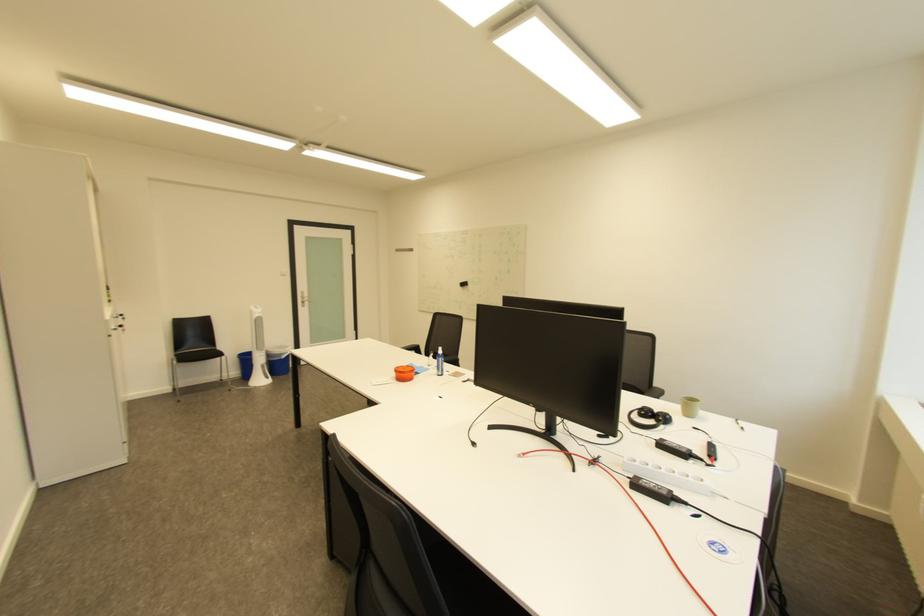
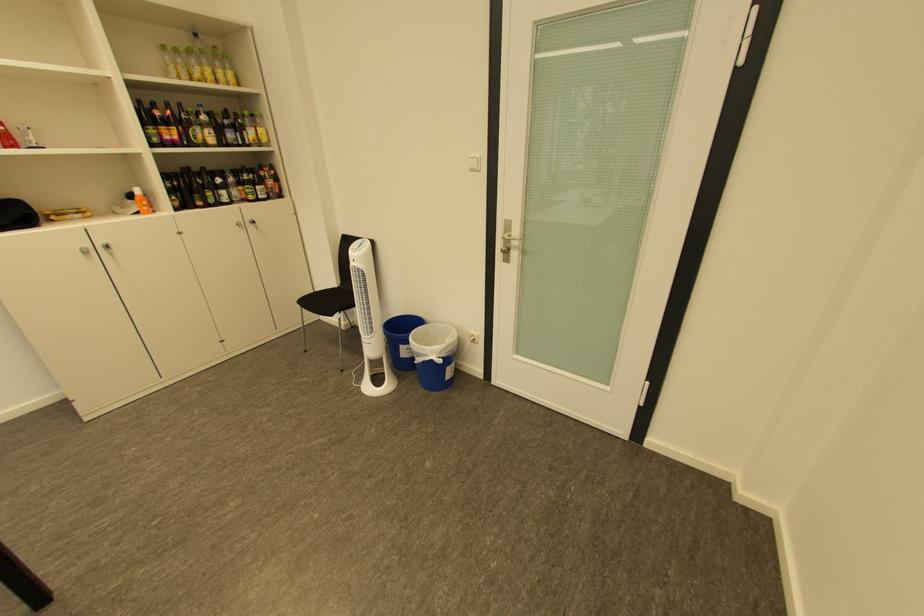
Locate, in the second image, the point that corresponds to (x=293, y=355) in the first image.

(429, 355)